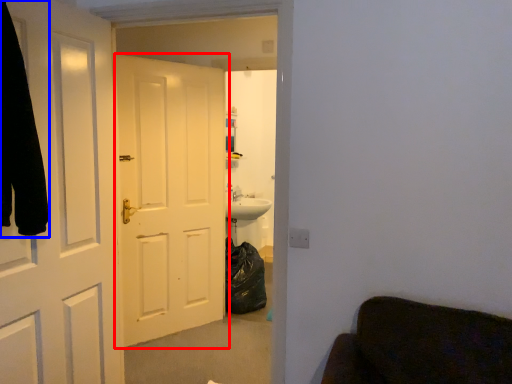
Question: Which object is closer to the camera taking this photo, door (highlighted by a red box) or robe (highlighted by a blue box)?

Choices:
 (A) door
 (B) robe

Answer: (B)